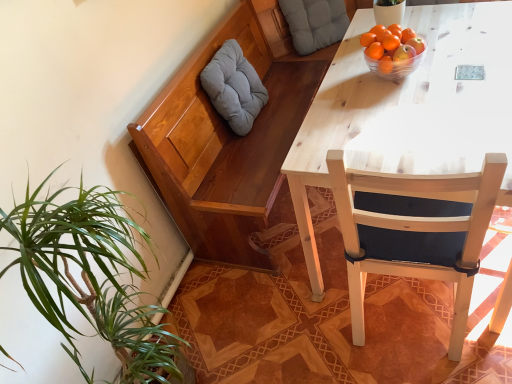
Question: Is wooden chair at right bigger than orange matte tangerine at upper right?

Choices:
 (A) yes
 (B) no

Answer: (A)

Question: From a real-world perspective, is wooden chair at right positioned over orange matte tangerine at upper right based on gravity?

Choices:
 (A) no
 (B) yes

Answer: (A)

Question: Is wooden chair at right positioned in front of orange matte tangerine at upper right?

Choices:
 (A) no
 (B) yes

Answer: (B)

Question: Could you tell me if wooden chair at right is turned towards orange matte tangerine at upper right?

Choices:
 (A) no
 (B) yes

Answer: (B)

Question: Does wooden chair at right lie behind orange matte tangerine at upper right?

Choices:
 (A) no
 (B) yes

Answer: (A)

Question: Does wooden chair at right have a smaller size compared to orange matte tangerine at upper right?

Choices:
 (A) yes
 (B) no

Answer: (B)

Question: Is orange matte at upper right surrounding orange matte tangerine at upper right?

Choices:
 (A) no
 (B) yes

Answer: (A)

Question: From the image's perspective, is orange matte at upper right over orange matte tangerine at upper right?

Choices:
 (A) no
 (B) yes

Answer: (A)

Question: Considering the relative sizes of orange matte at upper right and orange matte tangerine at upper right in the image provided, is orange matte at upper right smaller than orange matte tangerine at upper right?

Choices:
 (A) no
 (B) yes

Answer: (A)

Question: Is orange matte at upper right shorter than orange matte tangerine at upper right?

Choices:
 (A) yes
 (B) no

Answer: (B)

Question: Is orange matte at upper right touching orange matte tangerine at upper right?

Choices:
 (A) yes
 (B) no

Answer: (A)

Question: Is orange matte at upper right far away from orange matte tangerine at upper right?

Choices:
 (A) no
 (B) yes

Answer: (A)

Question: Is orange matte at upper right at the back of gray fabric pillow at upper left, which is the second pillow in right-to-left order?

Choices:
 (A) no
 (B) yes

Answer: (A)